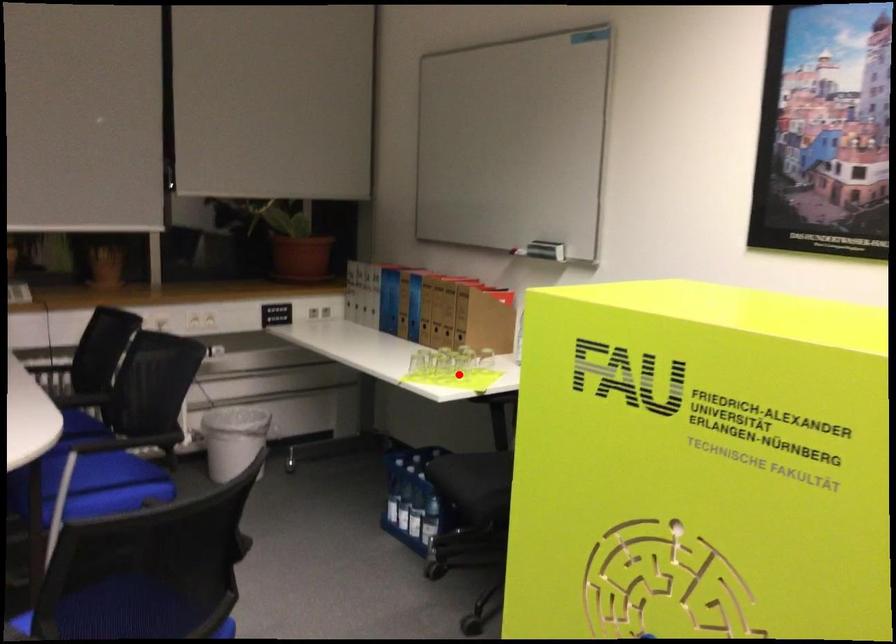
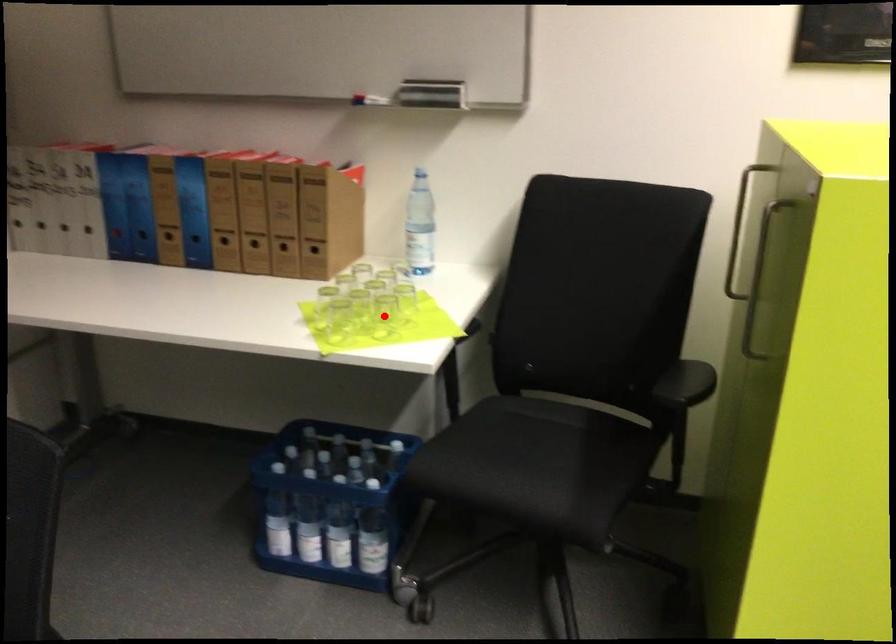
I am providing you with two images of the same scene from different viewpoints. A red point is marked on the first image and another point is marked on the second image. Is the marked point in image1 the same physical position as the marked point in image2?

Yes